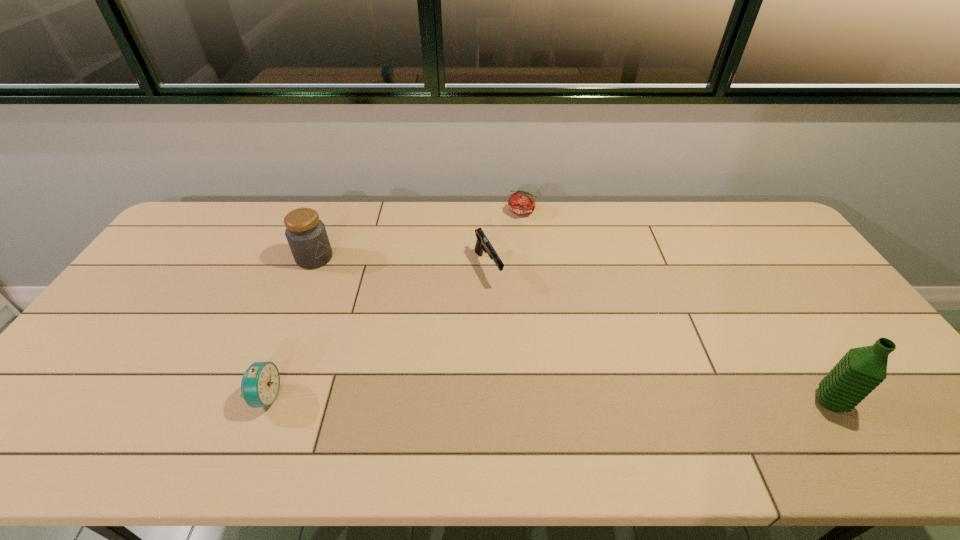
Find the location of `alarm clock`. alarm clock is located at coordinates (260, 384).

At what (x,y) coordinates should I click in order to perform the action: click on the rightmost object. Please return your answer as a coordinate pair (x, y). This screenshot has width=960, height=540. Looking at the image, I should click on (861, 370).

The height and width of the screenshot is (540, 960). In order to click on water bottle in this screenshot , I will do `click(861, 370)`.

At what (x,y) coordinates should I click in order to perform the action: click on the fourth shortest object. Please return your answer as a coordinate pair (x, y). Looking at the image, I should click on (307, 237).

This screenshot has height=540, width=960. I want to click on gun, so click(482, 243).

Image resolution: width=960 pixels, height=540 pixels. Identify the location of the farthest object. (521, 202).

Find the location of a particular element. This screenshot has height=540, width=960. the shortest object is located at coordinates (521, 202).

Locate an element on the screen. blank space located on the front-facing side of the alarm clock is located at coordinates (312, 397).

Locate an element on the screen. blank area located on the left of the water bottle is located at coordinates (766, 402).

Identify the location of vacant space situated on the surface of the second tallest object near the warning symbol. (354, 288).